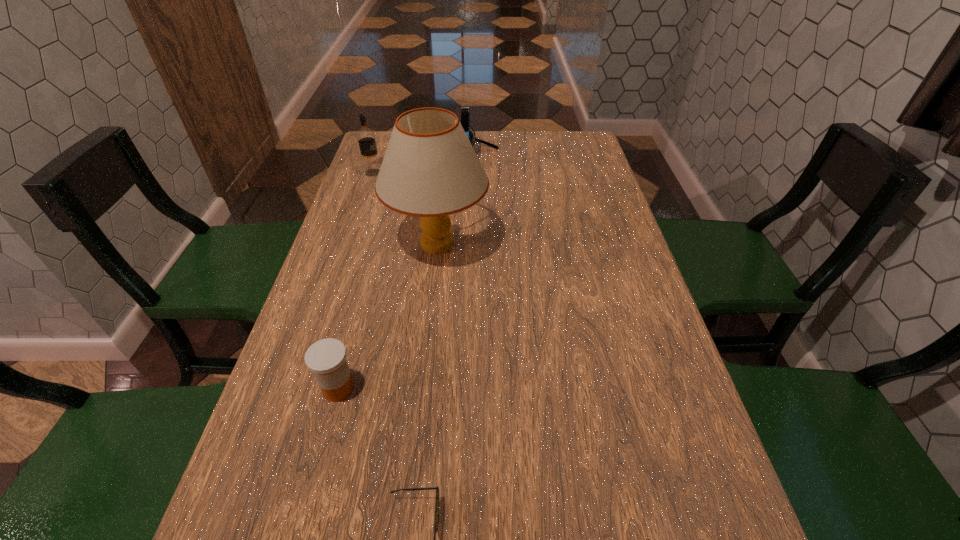
Identify which object is the third nearest to the leftmost object. Please provide its 2D coordinates. Your answer should be formatted as a tuple, i.e. [(x, y)], where the tuple contains the x and y coordinates of a point satisfying the conditions above.

[(326, 358)]

Identify which object is the fourth closest to the second shortest object. Please provide its 2D coordinates. Your answer should be formatted as a tuple, i.e. [(x, y)], where the tuple contains the x and y coordinates of a point satisfying the conditions above.

[(465, 110)]

The image size is (960, 540). Find the location of `free space that satisfies the following two spatial constraints: 1. with the microphone attached to the side of the headset; 2. on the front side of the lampshade`. free space that satisfies the following two spatial constraints: 1. with the microphone attached to the side of the headset; 2. on the front side of the lampshade is located at coordinates (477, 244).